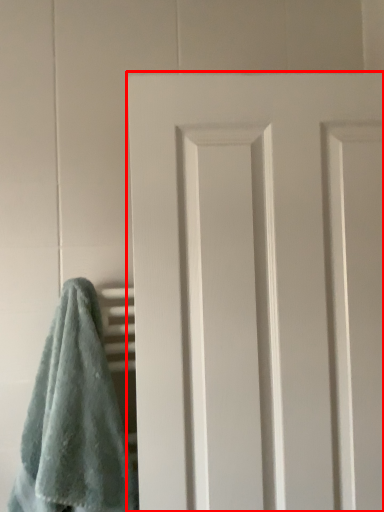
Question: From the image, what is the correct spatial relationship of door (annotated by the red box) in relation to towel?

Choices:
 (A) left
 (B) right

Answer: (B)